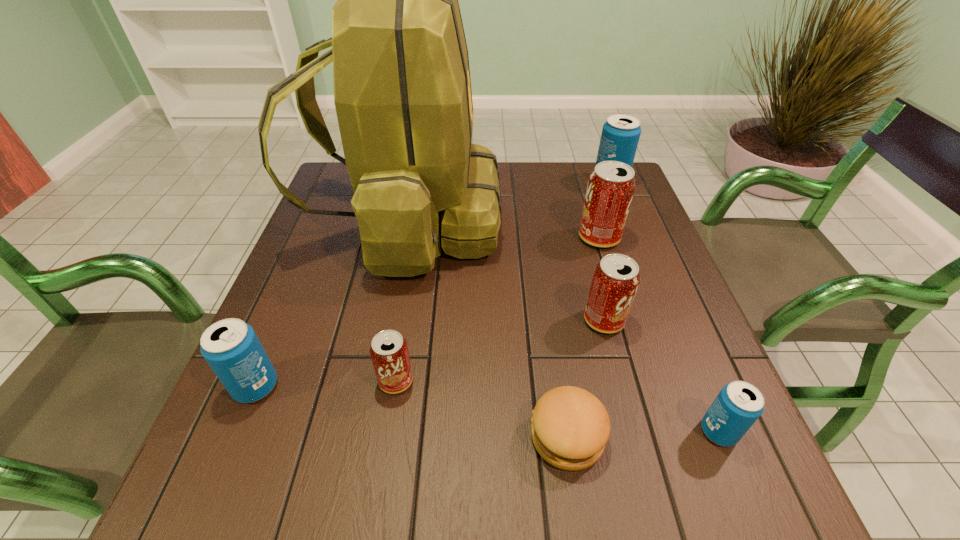
This screenshot has height=540, width=960. Find the location of `empty space between the second biggest blue soda can and the second farthest red soda can`. empty space between the second biggest blue soda can and the second farthest red soda can is located at coordinates (430, 353).

The height and width of the screenshot is (540, 960). What are the coordinates of `free area in between the shortest object and the biggest red soda can` in the screenshot? It's located at (583, 337).

Locate an element on the screen. This screenshot has width=960, height=540. free space between the biggest red soda can and the fifth object from right to left is located at coordinates (583, 337).

Identify the location of vacant space in between the second farthest soda can and the second nearest blue soda can. The image size is (960, 540). (427, 312).

You are a GUI agent. You are given a task and a screenshot of the screen. Output one action in this format:
    pyautogui.click(x=<x>, y=<y>)
    Task: Click on the unoccupied area between the backpack and the biggest blue soda can
    The width and height of the screenshot is (960, 540).
    Given the screenshot: What is the action you would take?
    pyautogui.click(x=508, y=201)

At what (x,y) coordinates should I click in order to perform the action: click on object that ranks as the fifth closest to the second farthest red soda can. Please return your answer as a coordinate pair (x, y). Image resolution: width=960 pixels, height=540 pixels. Looking at the image, I should click on (389, 352).

The image size is (960, 540). In order to click on object that is the second closest to the tallest object in this screenshot , I will do `click(611, 186)`.

The height and width of the screenshot is (540, 960). I want to click on soda can identified as the fourth closest to the tallest object, so click(231, 347).

At what (x,y) coordinates should I click in order to perform the action: click on the fifth closest soda can relative to the fifth soda can from right to left. Please return your answer as a coordinate pair (x, y). This screenshot has height=540, width=960. Looking at the image, I should click on (620, 135).

Locate an element on the screen. blue soda can that is the third closest to the third farthest soda can is located at coordinates (231, 347).